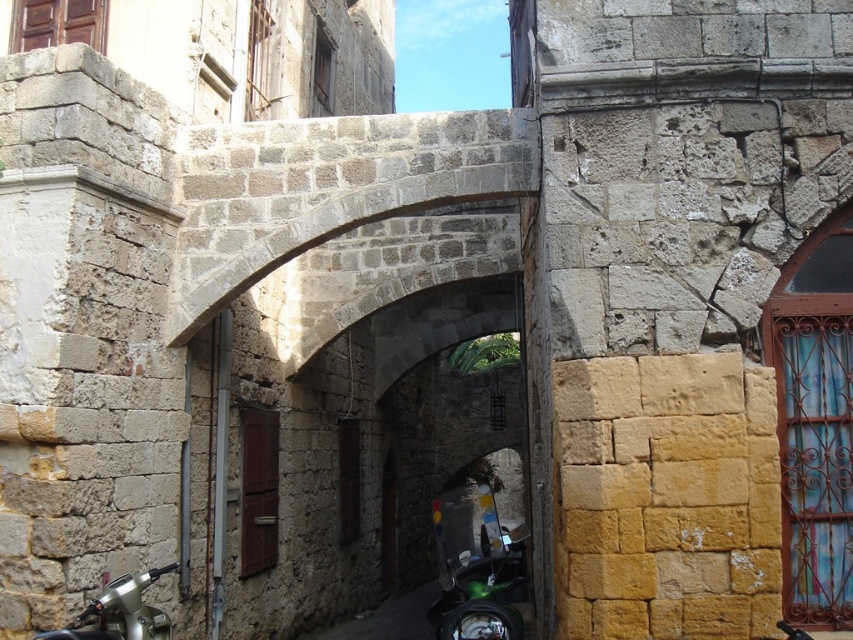
Question: Is shiny metallic motorcycle at lower right bigger than metallic silver motorcycle at lower left?

Choices:
 (A) yes
 (B) no

Answer: (A)

Question: Which of the following is the farthest from the observer?

Choices:
 (A) metallic silver motorcycle at lower left
 (B) shiny metallic motorcycle at lower right

Answer: (B)

Question: Does shiny metallic motorcycle at lower right have a larger size compared to metallic silver motorcycle at lower left?

Choices:
 (A) no
 (B) yes

Answer: (B)

Question: Is shiny metallic motorcycle at lower right above metallic silver motorcycle at lower left?

Choices:
 (A) yes
 (B) no

Answer: (B)

Question: Which of the following is the closest to the observer?

Choices:
 (A) (463, 580)
 (B) (131, 579)

Answer: (B)